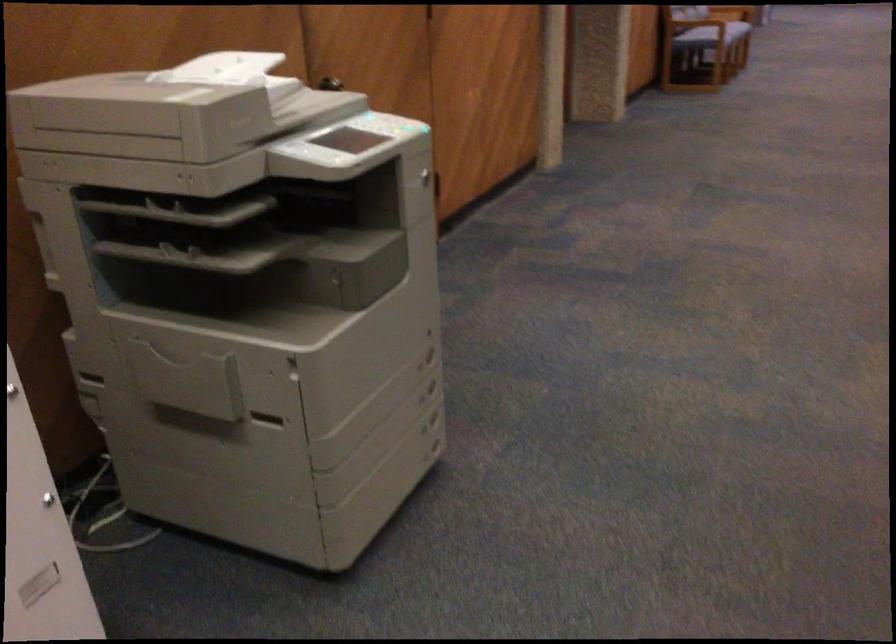
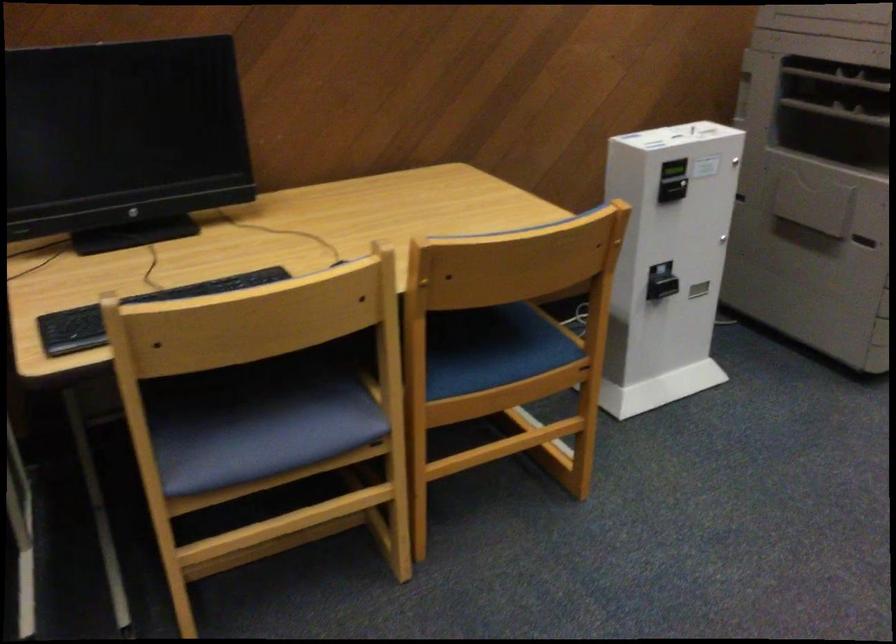
Locate, in the second image, the point that corresponds to point (168, 270) in the first image.

(836, 111)